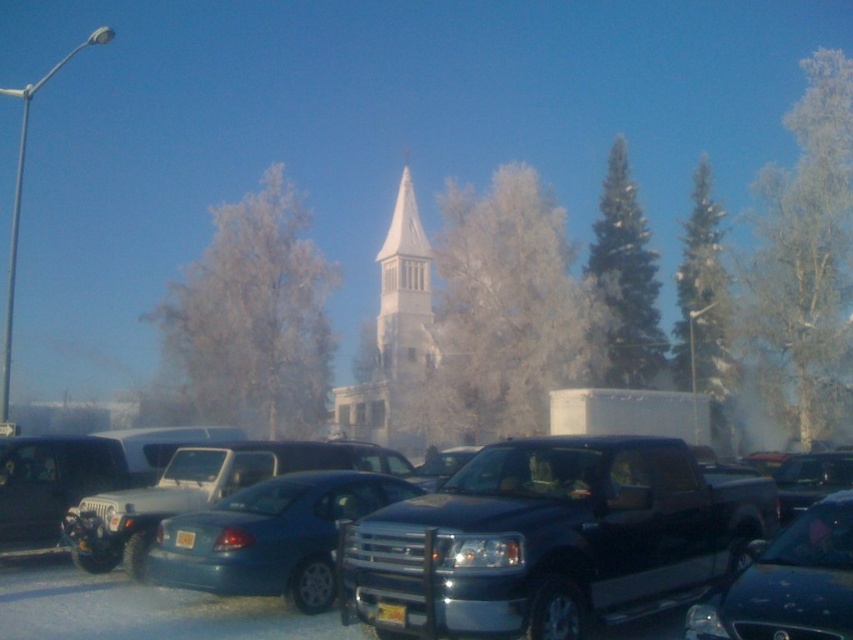
Question: Which of the following is the farthest from the observer?

Choices:
 (A) (340, 506)
 (B) (97, 525)
 (C) (236, 628)

Answer: (B)

Question: Is metallic blue sedan at center wider than blue metallic sedan at center?

Choices:
 (A) yes
 (B) no

Answer: (A)

Question: Which object appears closest to the camera in this image?

Choices:
 (A) metallic blue sedan at center
 (B) shiny black truck at center
 (C) blue metallic sedan at center

Answer: (B)

Question: Is metallic blue sedan at center thinner than blue metallic sedan at center?

Choices:
 (A) yes
 (B) no

Answer: (B)

Question: Is shiny black truck at center closer to camera compared to blue metallic sedan at center?

Choices:
 (A) yes
 (B) no

Answer: (A)

Question: Which point is farther to the camera?

Choices:
 (A) blue metallic sedan at center
 (B) shiny black truck at center

Answer: (A)